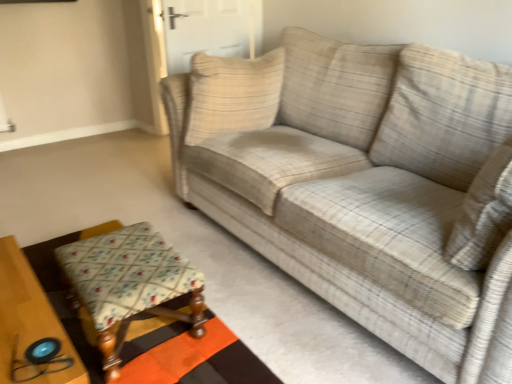
Question: From a real-world perspective, is floral fabric stool at lower left located beneath beige textured pillow at center?

Choices:
 (A) yes
 (B) no

Answer: (A)

Question: Is floral fabric stool at lower left positioned far away from beige textured pillow at center?

Choices:
 (A) yes
 (B) no

Answer: (B)

Question: Is floral fabric stool at lower left bigger than beige textured pillow at center?

Choices:
 (A) no
 (B) yes

Answer: (A)

Question: Considering the relative sizes of floral fabric stool at lower left and beige textured pillow at center in the image provided, is floral fabric stool at lower left smaller than beige textured pillow at center?

Choices:
 (A) yes
 (B) no

Answer: (A)

Question: Can you confirm if floral fabric stool at lower left is shorter than beige textured pillow at center?

Choices:
 (A) yes
 (B) no

Answer: (A)

Question: From the image's perspective, is floral fabric stool at lower left located above beige textured pillow at center?

Choices:
 (A) no
 (B) yes

Answer: (A)

Question: Considering the relative sizes of beige textured pillow at center and white fabric door at center in the image provided, is beige textured pillow at center thinner than white fabric door at center?

Choices:
 (A) yes
 (B) no

Answer: (B)

Question: Is beige textured pillow at center smaller than white fabric door at center?

Choices:
 (A) no
 (B) yes

Answer: (B)

Question: Can you confirm if beige textured pillow at center is bigger than white fabric door at center?

Choices:
 (A) no
 (B) yes

Answer: (A)

Question: Can you confirm if beige textured pillow at center is shorter than white fabric door at center?

Choices:
 (A) no
 (B) yes

Answer: (B)

Question: Is beige textured pillow at center with white fabric door at center?

Choices:
 (A) yes
 (B) no

Answer: (B)

Question: Does beige textured pillow at center have a greater height compared to white fabric door at center?

Choices:
 (A) yes
 (B) no

Answer: (B)

Question: Is white fabric door at center oriented towards plaid fabric couch at center?

Choices:
 (A) yes
 (B) no

Answer: (B)